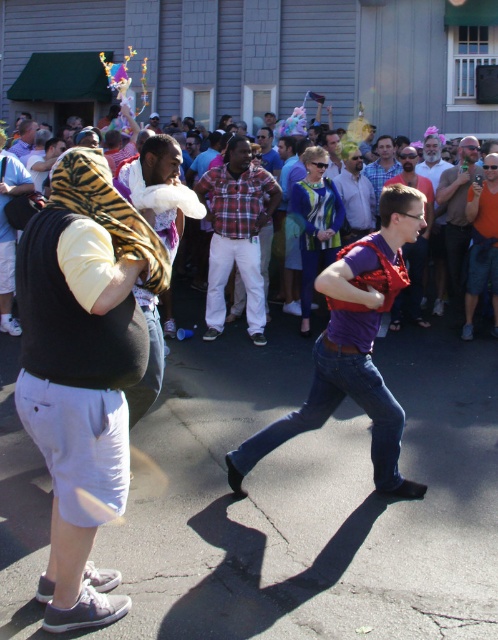
You are a photographer at the event and want to capture a photo of both the matte purple shirt at center and the matte black vest at center. To ensure both are in frame, should you position your camera to the left or right side of the two individuals?

The matte purple shirt at center is to the right of the matte black vest at center, so positioning the camera to the left side of the two individuals would allow both to be captured in the frame.

You are a photographer trying to capture both the purple matte shirt at center and the matte black shirt at center in a single frame. Based on their positions, which one might require you to adjust your camera angle to include them fully?

The purple matte shirt at center might be wider than the matte black shirt at center, so you might need to adjust your camera angle to include the purple matte shirt at center fully.